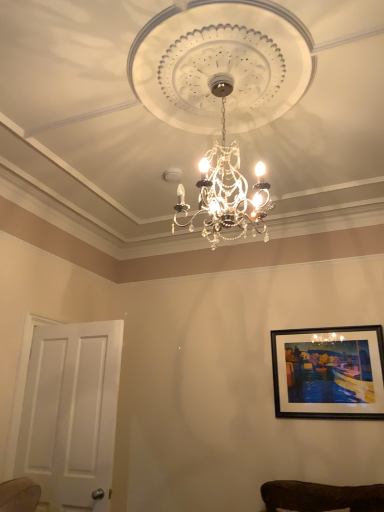
Question: From a real-world perspective, is black matte picture frame at upper right over crystal glass chandelier at center?

Choices:
 (A) yes
 (B) no

Answer: (B)

Question: Can you confirm if black matte picture frame at upper right is taller than crystal glass chandelier at center?

Choices:
 (A) yes
 (B) no

Answer: (B)

Question: Is black matte picture frame at upper right shorter than crystal glass chandelier at center?

Choices:
 (A) no
 (B) yes

Answer: (B)

Question: Is black matte picture frame at upper right beside crystal glass chandelier at center?

Choices:
 (A) yes
 (B) no

Answer: (B)

Question: Considering the relative sizes of black matte picture frame at upper right and crystal glass chandelier at center in the image provided, is black matte picture frame at upper right smaller than crystal glass chandelier at center?

Choices:
 (A) no
 (B) yes

Answer: (B)

Question: Considering the relative positions of black matte picture frame at upper right and crystal glass chandelier at center in the image provided, is black matte picture frame at upper right to the left of crystal glass chandelier at center from the viewer's perspective?

Choices:
 (A) no
 (B) yes

Answer: (A)

Question: Is white matte door at left positioned with its back to crystal glass chandelier at center?

Choices:
 (A) yes
 (B) no

Answer: (B)

Question: Is white matte door at left in contact with crystal glass chandelier at center?

Choices:
 (A) no
 (B) yes

Answer: (A)

Question: Is white matte door at left at the right side of crystal glass chandelier at center?

Choices:
 (A) yes
 (B) no

Answer: (B)

Question: Considering the relative sizes of white matte door at left and crystal glass chandelier at center in the image provided, is white matte door at left shorter than crystal glass chandelier at center?

Choices:
 (A) no
 (B) yes

Answer: (A)

Question: From a real-world perspective, does white matte door at left sit lower than crystal glass chandelier at center?

Choices:
 (A) no
 (B) yes

Answer: (B)

Question: Considering the relative sizes of white matte door at left and crystal glass chandelier at center in the image provided, is white matte door at left bigger than crystal glass chandelier at center?

Choices:
 (A) yes
 (B) no

Answer: (B)

Question: Is white matte door at left shorter than black matte picture frame at upper right?

Choices:
 (A) no
 (B) yes

Answer: (A)